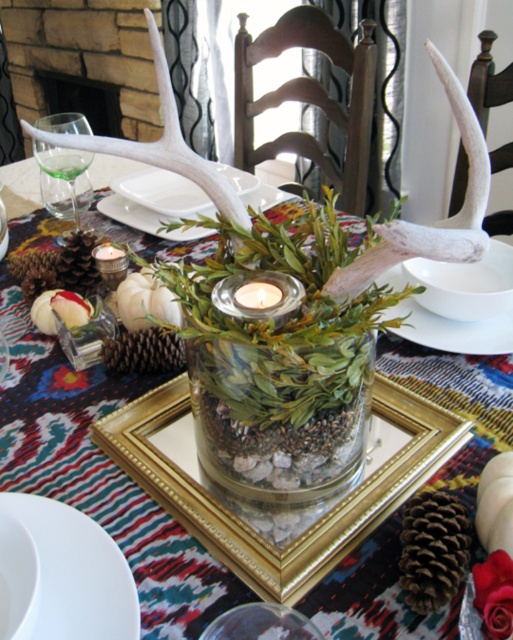
You are a guest at a dinner party and need to place a small ornament on the table. The ornament is exactly the same height as the translucent glass candle at center. Can you place it on the white porcelain plate at center without it being taller than the plate?

The white porcelain plate at center has a greater height compared to the translucent glass candle at center. Since the ornament is the same height as the candle, it will not exceed the plate height. Therefore, you can place it on the white porcelain plate at center without it being taller than the plate.

You are a guest at a dinner party and want to place your napkin on the table. The host mentioned that the napkin should be placed exactly between the brown rough pine cone at center and the white porcelain plate at center. How far apart are these two items so you can ensure proper placement?

The brown rough pine cone at center is 23.07 inches away from the white porcelain plate at center, so you should place the napkin exactly halfway between them, which would be at 11.535 inches from each item.

You are planning to place a small decoration on the table. The coordinates given are in a grid where the bottom left corner is the origin point. Where would you place it to avoid the brown rough pine cone at center?

Place the decoration anywhere except the coordinates point (433, 548) to avoid the brown rough pine cone at center.